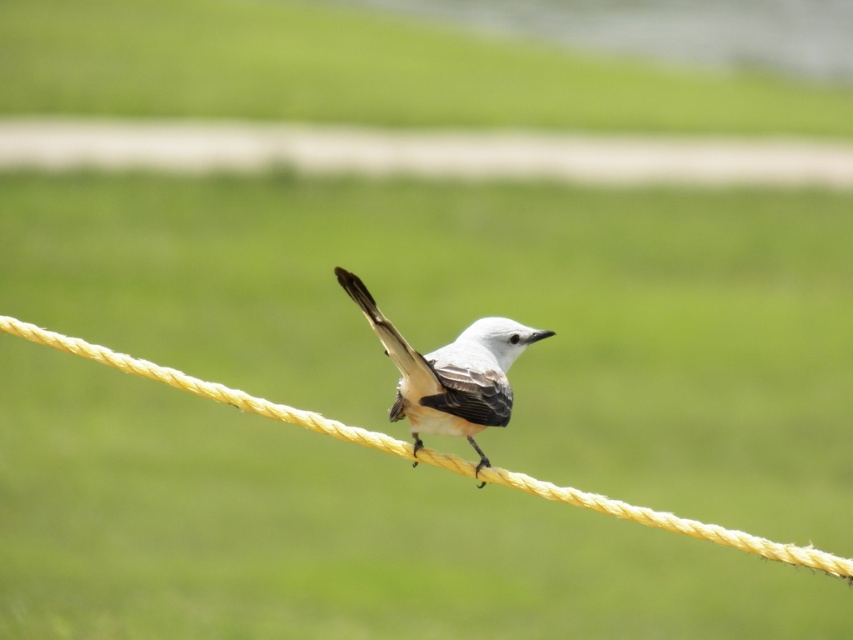
Question: Which of the following is the farthest from the observer?

Choices:
 (A) yellow rope at center
 (B) white matte bird at center

Answer: (A)

Question: Is yellow rope at center above white matte bird at center?

Choices:
 (A) no
 (B) yes

Answer: (A)

Question: Among these points, which one is nearest to the camera?

Choices:
 (A) (369, 307)
 (B) (335, 433)

Answer: (A)

Question: Does yellow rope at center appear over white matte bird at center?

Choices:
 (A) no
 (B) yes

Answer: (A)

Question: Is yellow rope at center to the right of white matte bird at center from the viewer's perspective?

Choices:
 (A) no
 (B) yes

Answer: (A)